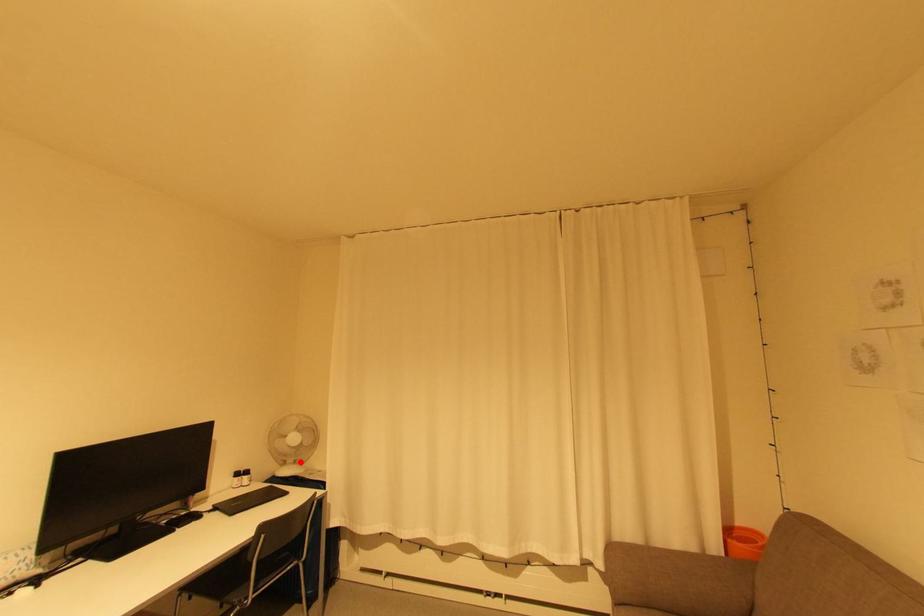
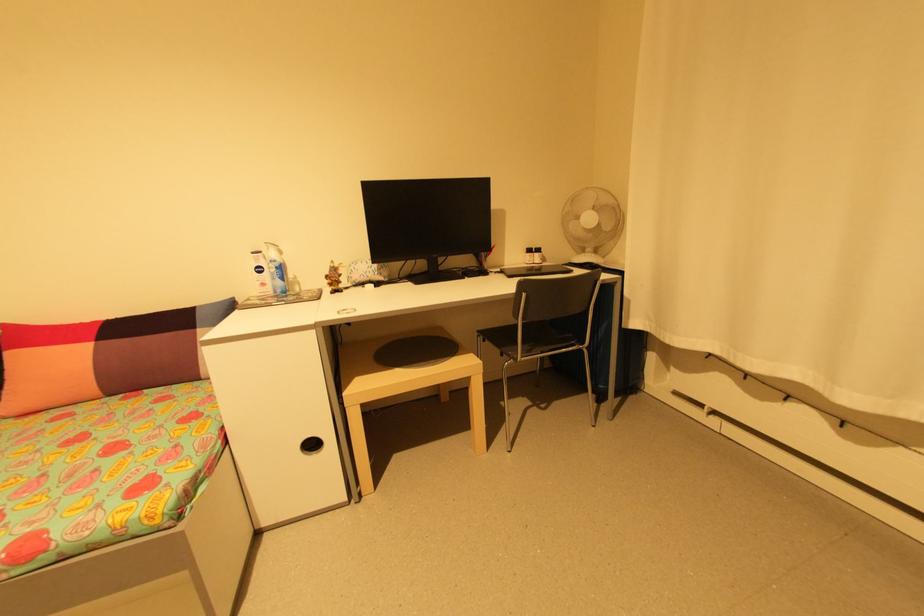
Question: I am providing you with two images of the same scene from different viewpoints. In image1, a red point is highlighted. Considering the same 3D point in image2, which of the following is correct?

Choices:
 (A) It is closer
 (B) It is farther

Answer: (A)